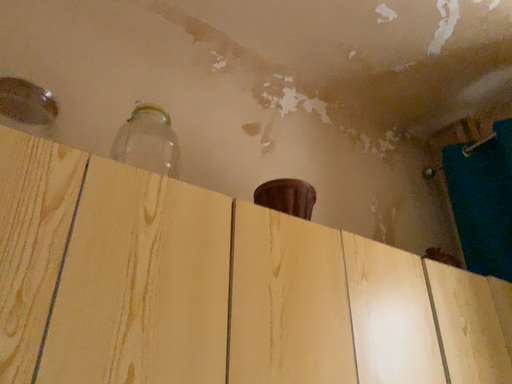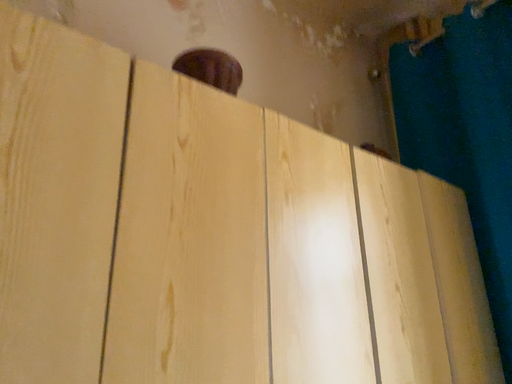
Question: Which way did the camera rotate in the video?

Choices:
 (A) rotated upward
 (B) rotated downward

Answer: (B)